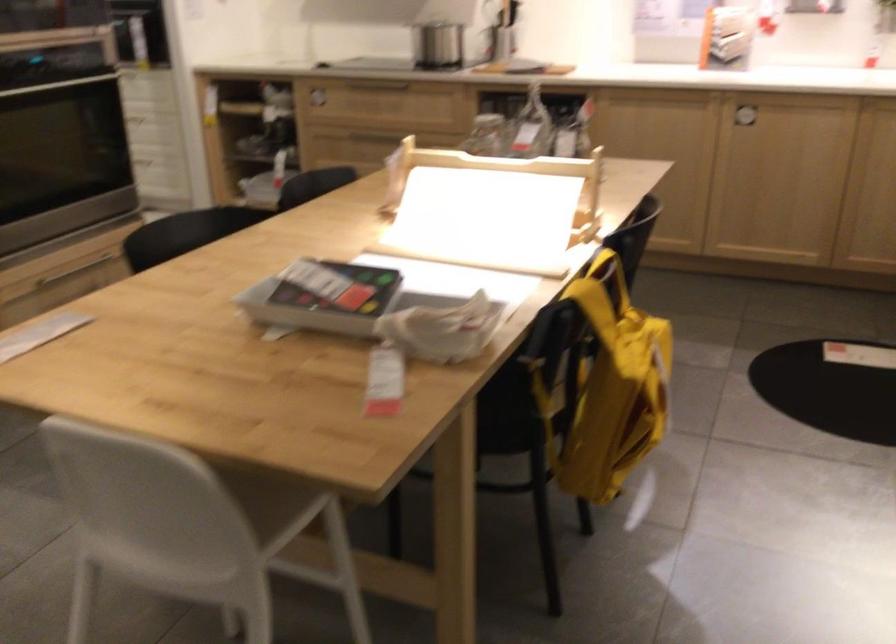
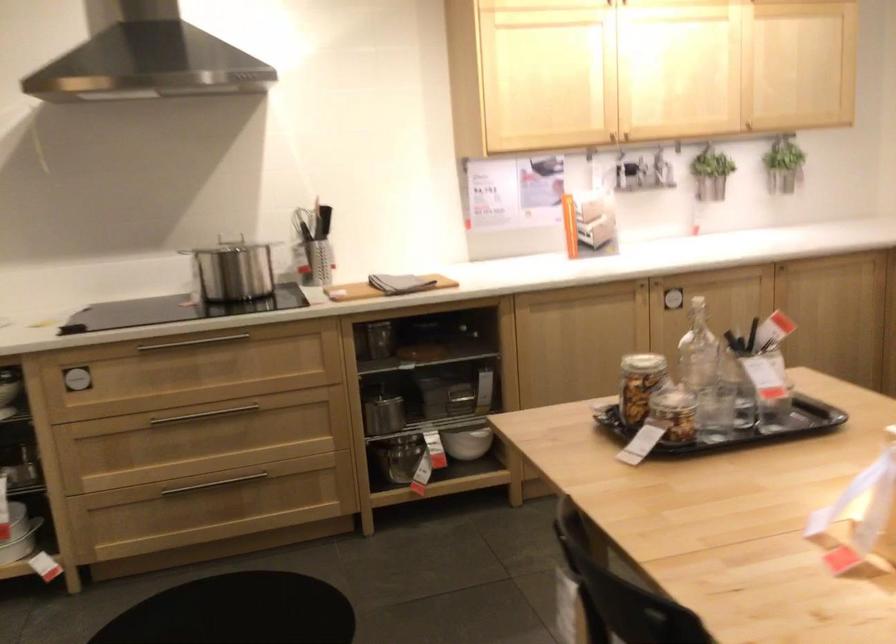
Question: I am providing you with two images of the same scene from different viewpoints. Please identify which objects are invisible in image2.

Choices:
 (A) small glass jar
 (B) metal bowl
 (C) hanging metal bucket
 (D) none of these

Answer: (D)